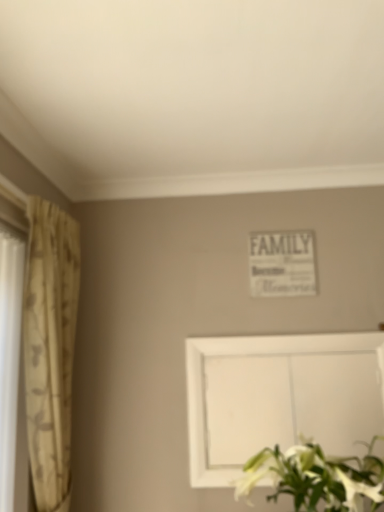
Question: Is beige floral fabric curtain at left taller or shorter than white matte floral arrangement at lower right?

Choices:
 (A) tall
 (B) short

Answer: (A)

Question: From the image's perspective, is beige floral fabric curtain at left positioned above or below white matte floral arrangement at lower right?

Choices:
 (A) above
 (B) below

Answer: (A)

Question: Estimate the real-world distances between objects in this image. Which object is closer to the white matte picture frame at lower center?

Choices:
 (A) beige floral fabric curtain at left
 (B) white matte floral arrangement at lower right

Answer: (B)

Question: Based on their relative distances, which object is farther from the white matte floral arrangement at lower right?

Choices:
 (A) beige floral fabric curtain at left
 (B) white matte picture frame at lower center

Answer: (A)